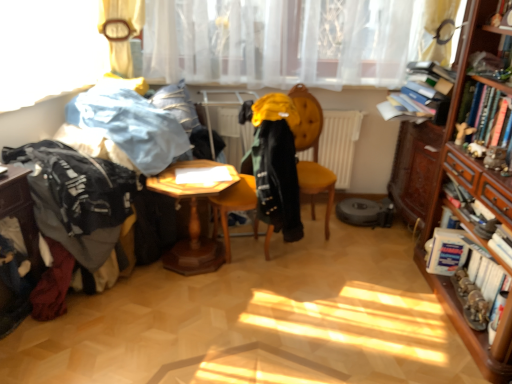
The height and width of the screenshot is (384, 512). I want to click on vacant area located to the right-hand side of velvet yellow chair at center, so click(x=357, y=239).